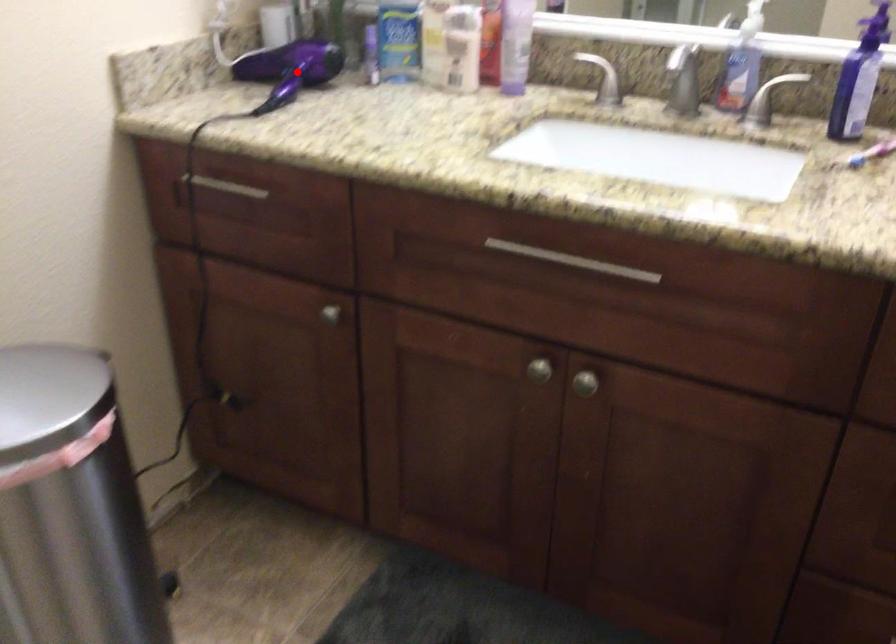
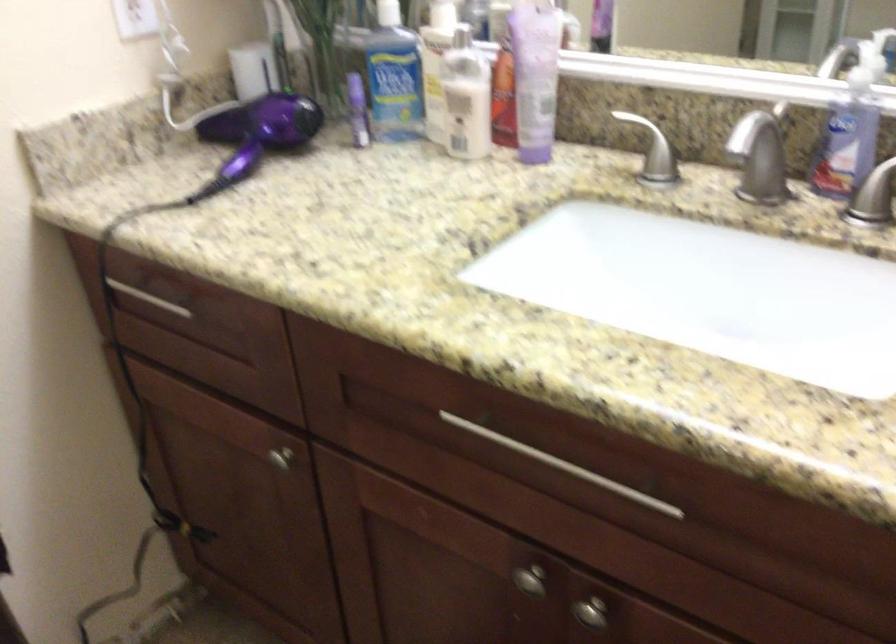
In the second image, find the point that corresponds to the highlighted location in the first image.

(256, 134)